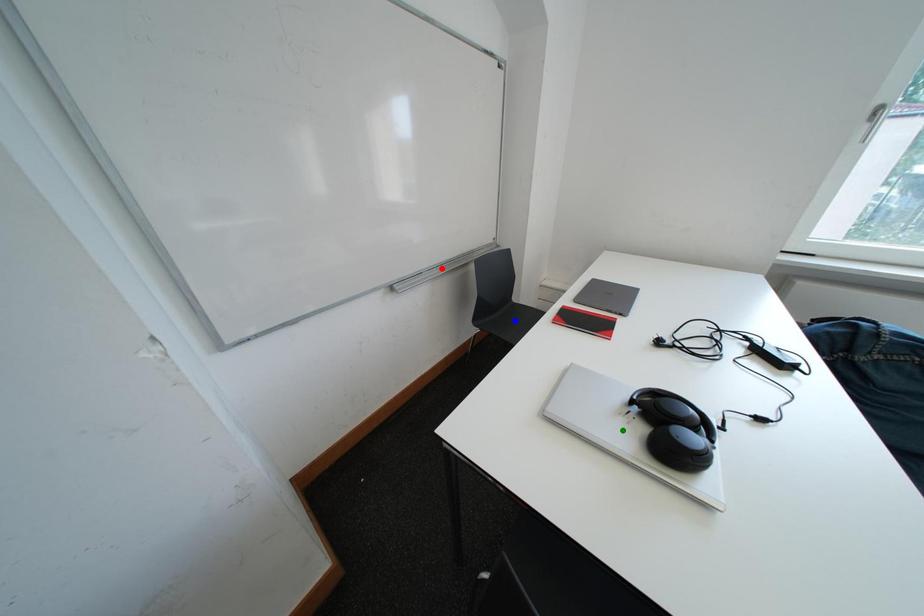
Order these from farthest to nearest:
A) blue point
B) green point
C) red point

red point → blue point → green point